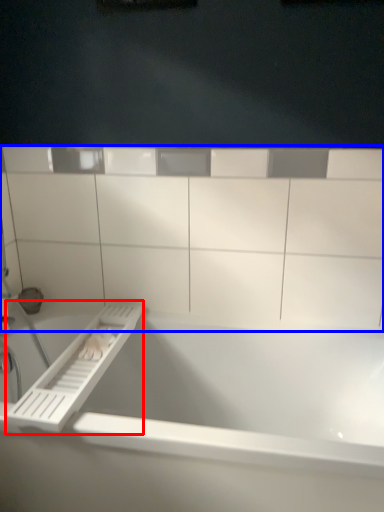
Question: Which of the following is the closest to the observer, towel bar (highlighted by a red box) or ledge (highlighted by a blue box)?

Choices:
 (A) towel bar
 (B) ledge

Answer: (A)